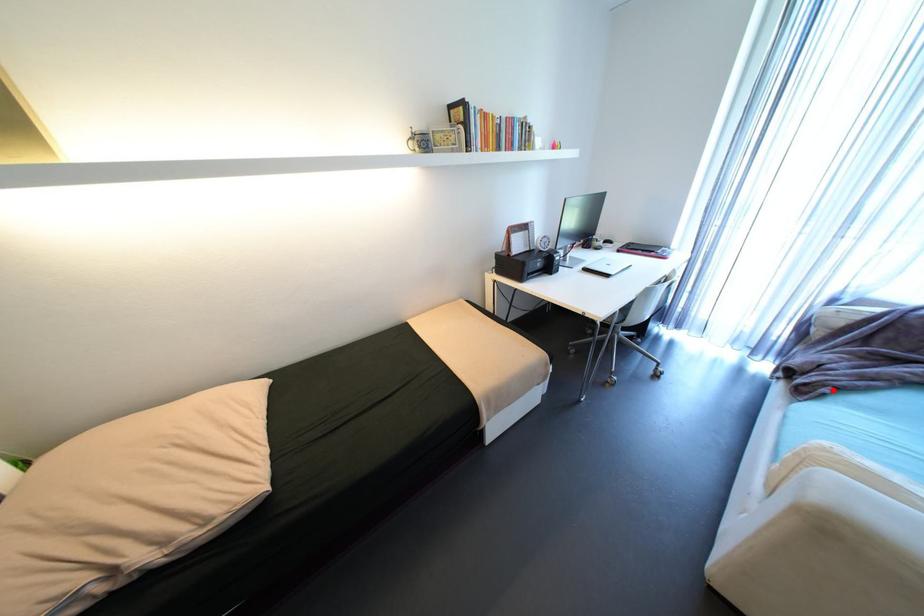
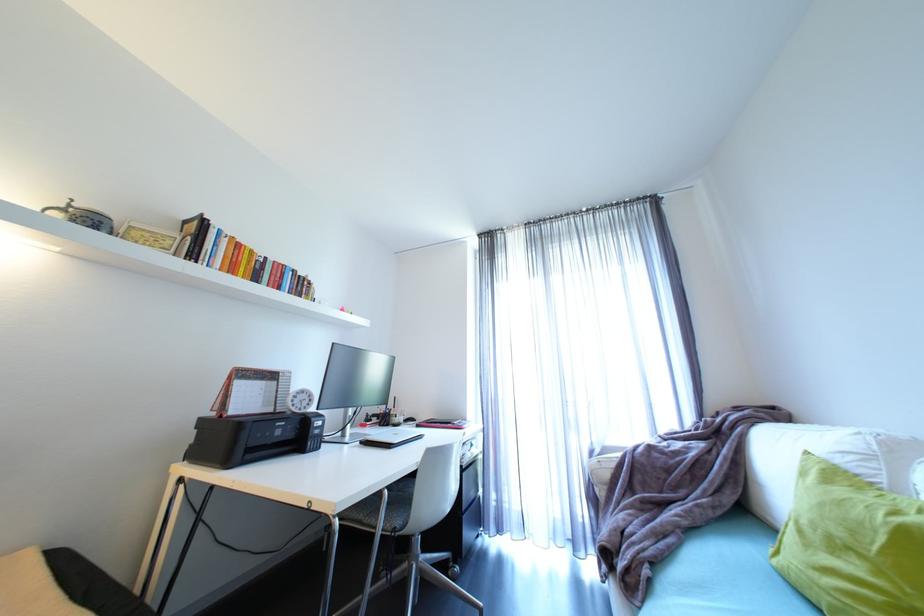
Question: I am providing you with two images of the same scene from different viewpoints. Given a red point in image1, look at the same physical point in image2. Is it:

Choices:
 (A) Closer to the viewpoint
 (B) Farther from the viewpoint

Answer: (A)